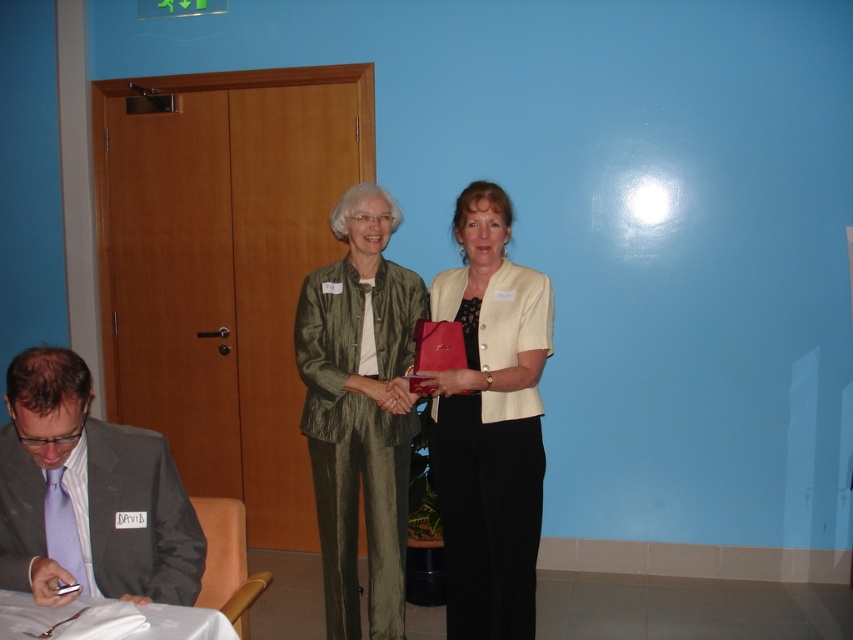
Question: Where is green textured suit at center located in relation to white cloth at lower left in the image?

Choices:
 (A) below
 (B) above

Answer: (B)

Question: Which point is farther from the camera taking this photo?

Choices:
 (A) (3, 627)
 (B) (376, 586)
 (C) (492, 460)
 (D) (48, 577)

Answer: (B)

Question: Which point appears farthest from the camera in this image?

Choices:
 (A) (358, 612)
 (B) (477, 509)

Answer: (A)

Question: Can you confirm if matte cream blazer at center is smaller than green textured suit at center?

Choices:
 (A) yes
 (B) no

Answer: (A)

Question: Considering the relative positions of matte cream blazer at center and white cloth at lower left in the image provided, where is matte cream blazer at center located with respect to white cloth at lower left?

Choices:
 (A) right
 (B) left

Answer: (A)

Question: Which of these objects is positioned closest to the gray suit at lower left?

Choices:
 (A) green textured suit at center
 (B) matte cream blazer at center
 (C) white cloth at lower left

Answer: (C)